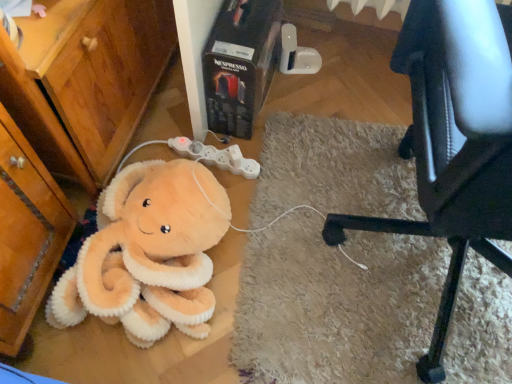
Where is `soft plush octopus at lower left`? The height and width of the screenshot is (384, 512). soft plush octopus at lower left is located at coordinates (148, 254).

Which is in front, point (217, 158) or point (89, 70)?

The point (89, 70) is in front.

Considering the relative positions of white plastic game controller at center and wooden dresser at lower left in the image provided, is white plastic game controller at center to the left of wooden dresser at lower left from the viewer's perspective?

In fact, white plastic game controller at center is to the right of wooden dresser at lower left.

Does white plastic game controller at center touch wooden dresser at lower left?

There is a gap between white plastic game controller at center and wooden dresser at lower left.

From their relative heights in the image, would you say white plastic game controller at center is taller or shorter than wooden dresser at lower left?

white plastic game controller at center is shorter than wooden dresser at lower left.

Is black leather chair at lower right in front of or behind white plastic game controller at center in the image?

black leather chair at lower right is positioned closer to the viewer than white plastic game controller at center.

Locate an element on the screen. The width and height of the screenshot is (512, 384). game controller directly beneath the black leather chair at lower right (from a real-world perspective) is located at coordinates (216, 156).

Is black leather chair at lower right smaller than white plastic game controller at center?

Incorrect, black leather chair at lower right is not smaller in size than white plastic game controller at center.

Identify the location of game controller on the right of wooden dresser at lower left. (216, 156).

From the image's perspective, is wooden dresser at lower left positioned above or below white plastic game controller at center?

Based on their image positions, wooden dresser at lower left is located beneath white plastic game controller at center.

Considering the relative sizes of wooden dresser at lower left and white plastic game controller at center in the image provided, is wooden dresser at lower left wider than white plastic game controller at center?

Yes, wooden dresser at lower left is wider than white plastic game controller at center.

Is black leather chair at lower right not close to soft plush octopus at lower left?

Actually, black leather chair at lower right and soft plush octopus at lower left are a little close together.

Which object is further away from the camera, black leather chair at lower right or soft plush octopus at lower left?

soft plush octopus at lower left is behind.

Is black leather chair at lower right to the left or to the right of soft plush octopus at lower left in the image?

In the image, black leather chair at lower right appears on the right side of soft plush octopus at lower left.

From the image's perspective, is black leather chair at lower right under soft plush octopus at lower left?

No.

Does black leather chair at lower right have a lesser width compared to wooden dresser at lower left?

No.

How far apart are black leather chair at lower right and wooden dresser at lower left?

26.54 inches.

Identify the location of dresser below the black leather chair at lower right (from the image's perspective). This screenshot has height=384, width=512. (86, 81).

Is black leather chair at lower right next to wooden dresser at lower left and touching it?

black leather chair at lower right and wooden dresser at lower left are clearly separated.

Which is correct: white plastic game controller at center is inside soft plush octopus at lower left, or outside of it?

white plastic game controller at center cannot be found inside soft plush octopus at lower left.

Does white plastic game controller at center have a greater width compared to soft plush octopus at lower left?

No.

Where is `game controller above the soft plush octopus at lower left (from the image's perspective)`? The width and height of the screenshot is (512, 384). game controller above the soft plush octopus at lower left (from the image's perspective) is located at coordinates [216, 156].

Is wooden dresser at lower left aimed at soft plush octopus at lower left?

Yes, wooden dresser at lower left is facing soft plush octopus at lower left.

How many degrees apart are the facing directions of wooden dresser at lower left and soft plush octopus at lower left?

100 degrees separate the facing orientations of wooden dresser at lower left and soft plush octopus at lower left.

From the image's perspective, is wooden dresser at lower left on soft plush octopus at lower left?

Yes, from the image's perspective, wooden dresser at lower left is on top of soft plush octopus at lower left.

Considering the relative positions of wooden dresser at lower left and soft plush octopus at lower left in the image provided, is wooden dresser at lower left in front of soft plush octopus at lower left?

Yes, it is in front of soft plush octopus at lower left.

Image resolution: width=512 pixels, height=384 pixels. I want to click on dresser that appears in front of the white plastic game controller at center, so (x=86, y=81).

This screenshot has width=512, height=384. Find the location of `game controller above the black leather chair at lower right (from the image's perspective)`. game controller above the black leather chair at lower right (from the image's perspective) is located at coordinates (216, 156).

When comparing their distances from black leather chair at lower right, does white plastic game controller at center or soft plush octopus at lower left seem further?

white plastic game controller at center lies further to black leather chair at lower right than the other object.

From the image, which object appears to be nearer to soft plush octopus at lower left, wooden dresser at lower left or white plastic game controller at center?

Based on the image, wooden dresser at lower left appears to be nearer to soft plush octopus at lower left.

In the scene shown: Based on their spatial positions, is white plastic game controller at center or black leather chair at lower right further from wooden dresser at lower left?

black leather chair at lower right is positioned further to the anchor wooden dresser at lower left.

Estimate the real-world distances between objects in this image. Which object is closer to wooden dresser at lower left, white plastic game controller at center or soft plush octopus at lower left?

Based on the image, soft plush octopus at lower left appears to be nearer to wooden dresser at lower left.

In the scene shown: Which object lies nearer to the anchor point white plastic game controller at center, soft plush octopus at lower left or wooden dresser at lower left?

soft plush octopus at lower left lies closer to white plastic game controller at center than the other object.

From the image, which object appears to be farther from white plastic game controller at center, soft plush octopus at lower left or black leather chair at lower right?

black leather chair at lower right lies further to white plastic game controller at center than the other object.

Looking at the image, which one is located closer to black leather chair at lower right, white plastic game controller at center or wooden dresser at lower left?

white plastic game controller at center is closer to black leather chair at lower right.

Considering their positions, is black leather chair at lower right positioned further to soft plush octopus at lower left than white plastic game controller at center?

black leather chair at lower right is positioned further to the anchor soft plush octopus at lower left.

At what (x,y) coordinates should I click in order to perform the action: click on toy situated between wooden dresser at lower left and black leather chair at lower right from left to right. Please return your answer as a coordinate pair (x, y). The width and height of the screenshot is (512, 384). Looking at the image, I should click on (148, 254).

Where is `toy between wooden dresser at lower left and white plastic game controller at center from front to back`? The image size is (512, 384). toy between wooden dresser at lower left and white plastic game controller at center from front to back is located at coordinates (148, 254).

What are the coordinates of `game controller located between wooden dresser at lower left and black leather chair at lower right in the left-right direction` in the screenshot? It's located at (216, 156).

Identify the location of toy between black leather chair at lower right and white plastic game controller at center from front to back. Image resolution: width=512 pixels, height=384 pixels. 148,254.